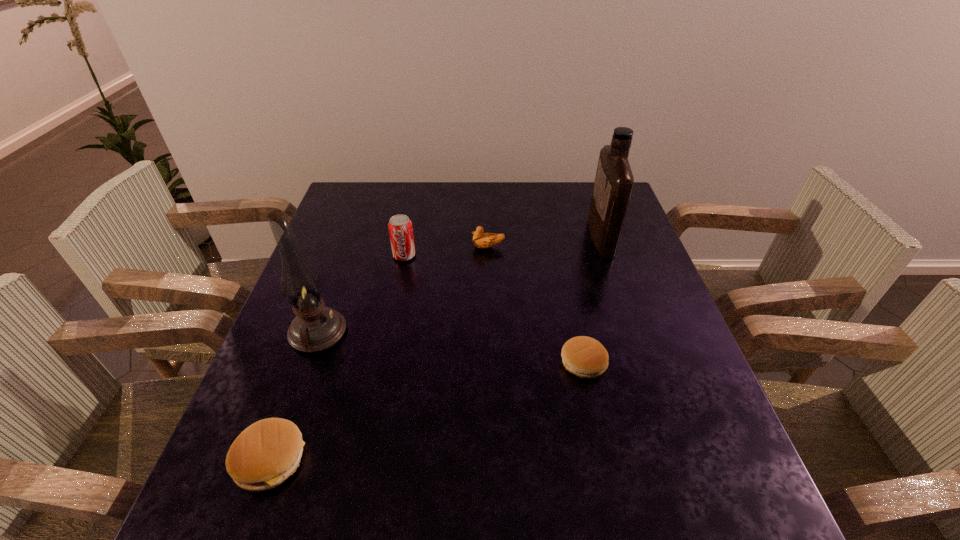
In the image, there is a desktop. Where is `vacant region at the far left corner`? The width and height of the screenshot is (960, 540). vacant region at the far left corner is located at coordinates (375, 212).

Locate an element on the screen. free region at the far right corner of the desktop is located at coordinates (588, 201).

The image size is (960, 540). I want to click on free space at the near right corner of the desktop, so click(698, 441).

Locate an element on the screen. The height and width of the screenshot is (540, 960). vacant area that lies between the liquor and the oil lamp is located at coordinates (459, 285).

Find the location of a particular element. Image resolution: width=960 pixels, height=540 pixels. vacant space that's between the nearest object and the fourth object from right to left is located at coordinates (338, 357).

I want to click on vacant area that lies between the taller patty and the duckling, so click(379, 353).

Locate an element on the screen. The width and height of the screenshot is (960, 540). vacant space that is in between the oil lamp and the rightmost object is located at coordinates (459, 285).

Locate an element on the screen. The image size is (960, 540). free space between the right patty and the rightmost object is located at coordinates (592, 300).

I want to click on empty space between the fifth object from left to right and the liquor, so click(592, 300).

Identify the location of free space between the oil lamp and the fourth object from left to right. This screenshot has height=540, width=960. (403, 290).